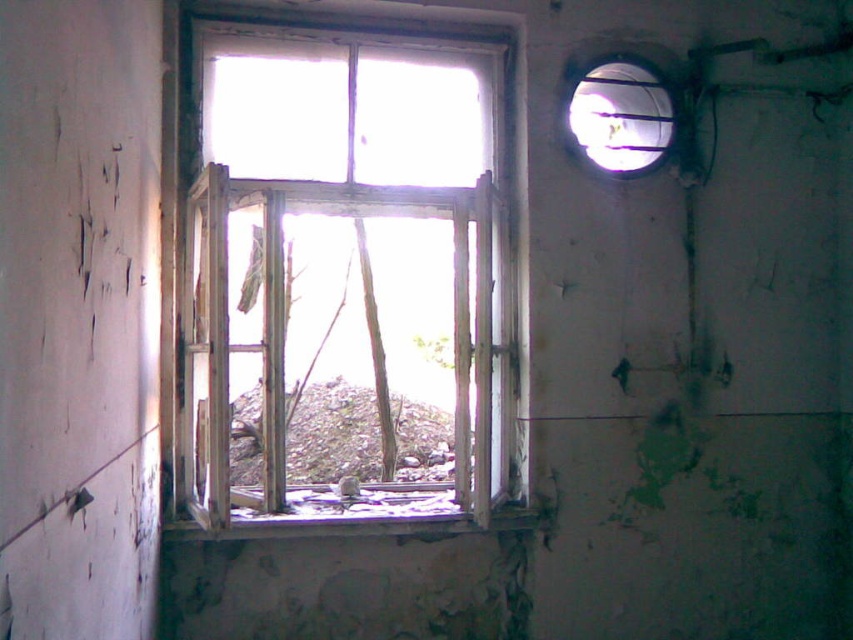
Question: Can you confirm if weathered wood window at center is smaller than rusty metallic debris at center?

Choices:
 (A) no
 (B) yes

Answer: (A)

Question: Which point is closer to the camera?

Choices:
 (A) (331, 467)
 (B) (427, 465)

Answer: (A)

Question: Which object is farther from the camera taking this photo?

Choices:
 (A) rusty metallic debris at center
 (B) weathered wood window at center

Answer: (B)

Question: Is weathered wood window at center positioned at the back of rusty metallic debris at center?

Choices:
 (A) yes
 (B) no

Answer: (A)

Question: Can you confirm if weathered wood window at center is thinner than rusty metallic debris at center?

Choices:
 (A) no
 (B) yes

Answer: (B)

Question: Which object is farther from the camera taking this photo?

Choices:
 (A) rusty metallic debris at center
 (B) weathered wood window at center

Answer: (B)